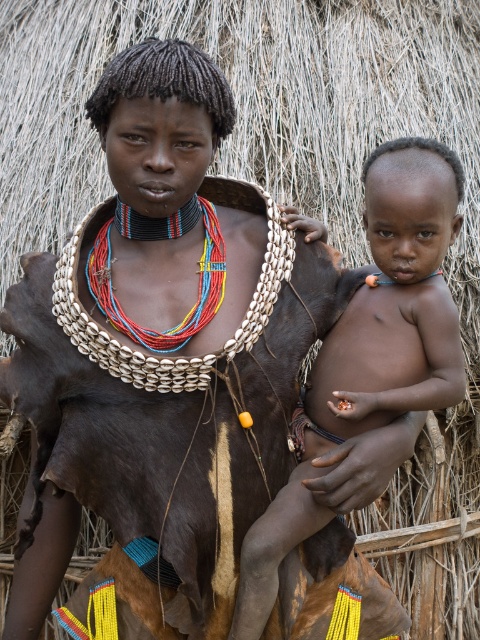
Based on the scene described, which object is positioned higher up in the image between the matte skin baby at center and the multicolored beaded necklace at center?

The matte skin baby at center is positioned higher up than the multicolored beaded necklace at center.

You are standing at the origin point in the image and want to move towards the thatched structure. Which point, point (268, 588) or point (134, 340), is closer to your current position?

Point (134, 340) is closer to your current position because it is in front of point (268, 588), which is behind it.

You are a photographer trying to capture the intricate details of the multicolored beaded necklace at center and the matte skin baby at center. Since you want to focus on both subjects, which one should you adjust your camera focus on first to ensure both are in frame?

The matte skin baby at center is below the multicolored beaded necklace at center, so you should focus on the multicolored beaded necklace at center first to ensure both are in frame.